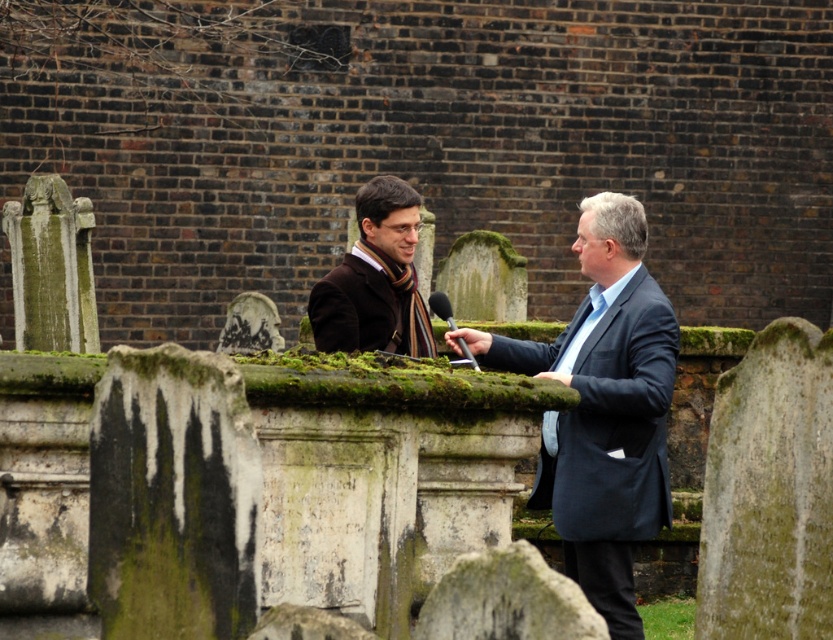
Question: Which is farther from the metallic silver microphone at center?

Choices:
 (A) matte brown coat at center
 (B) dark blue suit at center

Answer: (A)

Question: Does matte brown coat at center have a lesser width compared to metallic silver microphone at center?

Choices:
 (A) no
 (B) yes

Answer: (A)

Question: Can you confirm if matte brown coat at center is smaller than metallic silver microphone at center?

Choices:
 (A) yes
 (B) no

Answer: (B)

Question: Where is dark blue suit at center located in relation to metallic silver microphone at center in the image?

Choices:
 (A) above
 (B) below

Answer: (A)

Question: Which point is farther to the camera?

Choices:
 (A) dark blue suit at center
 (B) metallic silver microphone at center
 (C) matte brown coat at center

Answer: (B)

Question: Which point is farther from the camera taking this photo?

Choices:
 (A) (636, 292)
 (B) (382, 177)
 (C) (482, 344)

Answer: (B)